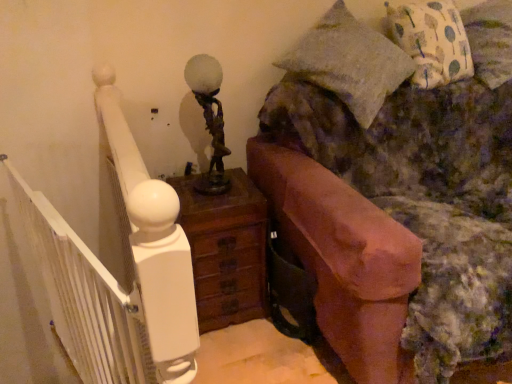
Question: From a real-world perspective, is printed fabric pillow at upper right positioned above or below terracotta clay fireplace at right?

Choices:
 (A) below
 (B) above

Answer: (B)

Question: Is printed fabric pillow at upper right bigger or smaller than terracotta clay fireplace at right?

Choices:
 (A) small
 (B) big

Answer: (A)

Question: Based on their relative distances, which object is nearer to the white painted wood balustrade at left?

Choices:
 (A) bronze/antique brass table lamp at center
 (B) terracotta clay fireplace at right
 (C) printed fabric pillow at upper right
 (D) brown wooden nightstand at center

Answer: (D)

Question: Which object is positioned closest to the bronze/antique brass table lamp at center?

Choices:
 (A) terracotta clay fireplace at right
 (B) brown wooden nightstand at center
 (C) white painted wood balustrade at left
 (D) printed fabric pillow at upper right

Answer: (B)